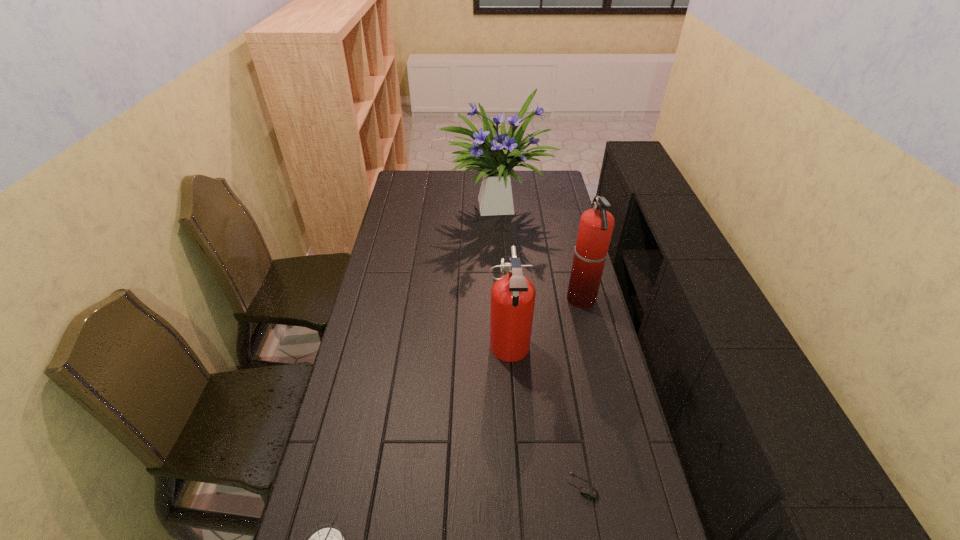
You are a GUI agent. You are given a task and a screenshot of the screen. Output one action in this format:
    pyautogui.click(x=<x>, y=<y>)
    Task: Click on the flower arrangement
    This screenshot has height=540, width=960.
    Given the screenshot: What is the action you would take?
    pyautogui.click(x=496, y=155)

The height and width of the screenshot is (540, 960). What are the coordinates of `the right fire extinguisher` in the screenshot? It's located at (596, 225).

Find the location of a particular element. This screenshot has width=960, height=540. the fourth nearest object is located at coordinates (596, 225).

This screenshot has height=540, width=960. What are the coordinates of `the shorter fire extinguisher` in the screenshot? It's located at (513, 295).

I want to click on the third nearest object, so click(x=513, y=295).

I want to click on the fourth farthest object, so click(x=587, y=491).

In order to click on mouse in this screenshot , I will do 587,491.

At what (x,y) coordinates should I click in order to perform the action: click on vacant space located 0.260m on the left of the flower arrangement. Please return your answer as a coordinate pair (x, y). The height and width of the screenshot is (540, 960). Looking at the image, I should click on (391, 204).

Where is `vacant point located with the nozzle and gauge on the second farthest object`? Image resolution: width=960 pixels, height=540 pixels. vacant point located with the nozzle and gauge on the second farthest object is located at coordinates [x=521, y=300].

You are a GUI agent. You are given a task and a screenshot of the screen. Output one action in this format:
    pyautogui.click(x=<x>, y=<y>)
    Task: Click on the free space located 0.100m with the nozzle and gauge on the second farthest object
    
    Given the screenshot: What is the action you would take?
    pyautogui.click(x=540, y=300)